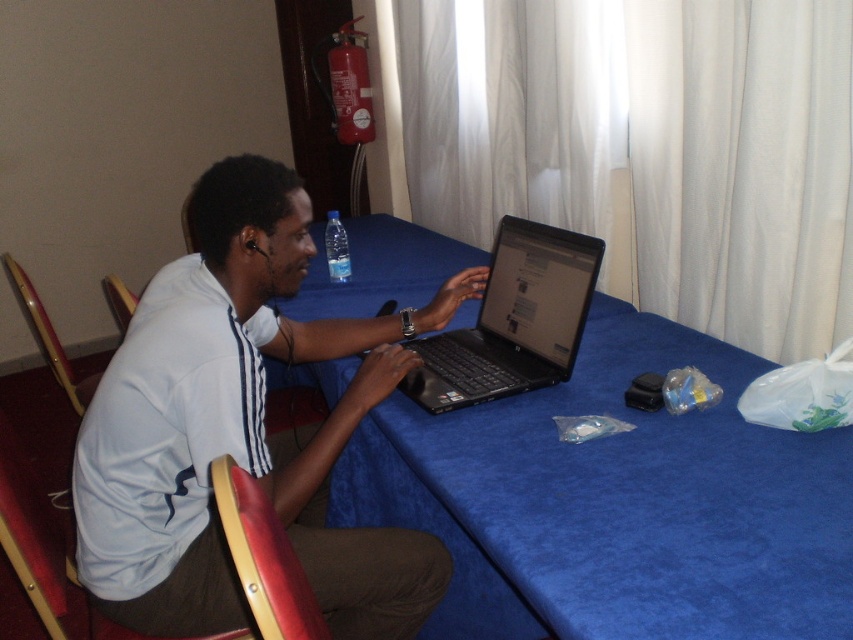
Looking at this image, is white matte shirt at center above transparent plastic bottle at center?

Incorrect, white matte shirt at center is not positioned above transparent plastic bottle at center.

Which is in front, point (119, 618) or point (339, 253)?

Point (119, 618) is in front.

Describe the element at coordinates (241, 428) in the screenshot. This screenshot has height=640, width=853. I see `white matte shirt at center` at that location.

Find the location of a particular element. The height and width of the screenshot is (640, 853). white matte shirt at center is located at coordinates (241, 428).

Does point (368, 608) come behind point (469, 394)?

No.

Between white matte shirt at center and black plastic laptop at center, which one has more height?

Standing taller between the two is white matte shirt at center.

Identify the location of white matte shirt at center. (241, 428).

Is blue fabric table at center above white matte shirt at center?

Incorrect, blue fabric table at center is not positioned above white matte shirt at center.

In the scene shown: Which of these two, blue fabric table at center or white matte shirt at center, stands taller?

Standing taller between the two is blue fabric table at center.

The height and width of the screenshot is (640, 853). What do you see at coordinates (616, 502) in the screenshot?
I see `blue fabric table at center` at bounding box center [616, 502].

The height and width of the screenshot is (640, 853). Find the location of `blue fabric table at center`. blue fabric table at center is located at coordinates (616, 502).